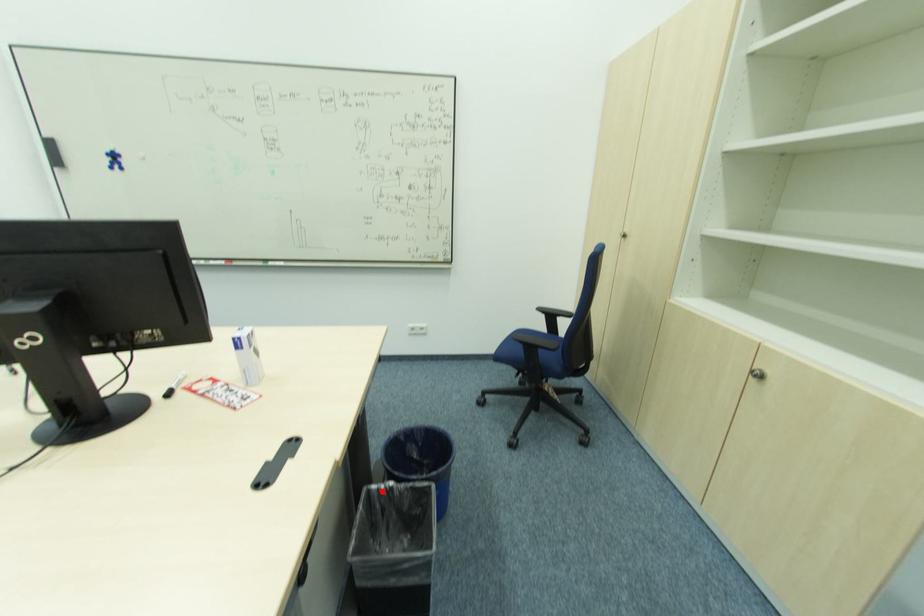
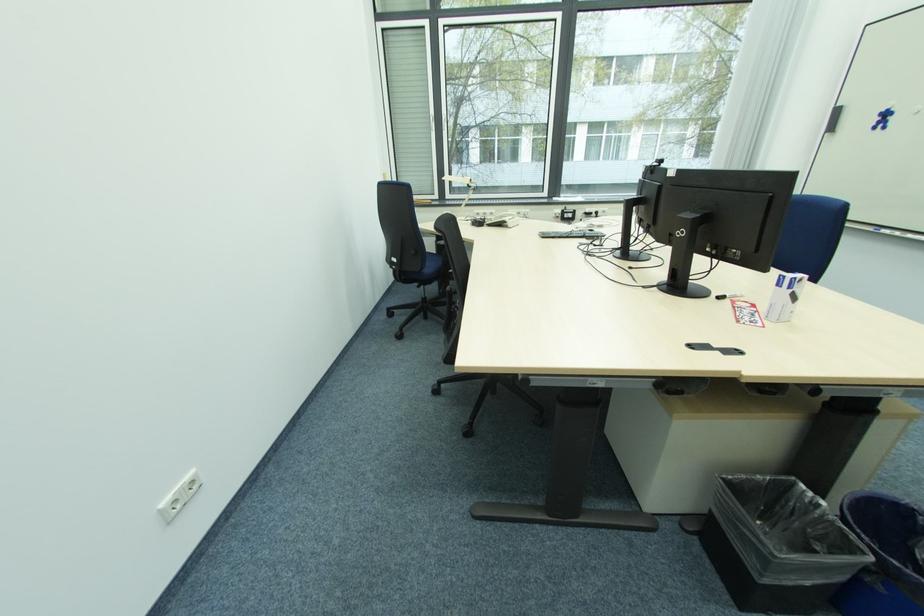
Find the pixel in the second image that matches the highlighted location in the first image.

(808, 495)